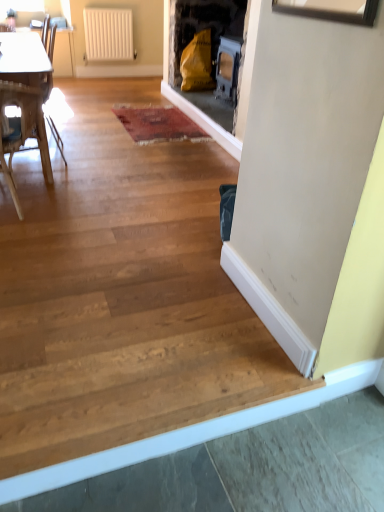
Question: From a real-world perspective, is white plastic radiator at upper center physically located above or below wooden armchair at left?

Choices:
 (A) below
 (B) above

Answer: (B)

Question: Is white plastic radiator at upper center inside the boundaries of wooden armchair at left, or outside?

Choices:
 (A) inside
 (B) outside

Answer: (B)

Question: Which of these objects is positioned farthest from the wooden armchair at left?

Choices:
 (A) wooden chair at left
 (B) white plastic radiator at upper center

Answer: (A)

Question: Which object is the farthest from the wooden armchair at left?

Choices:
 (A) wooden chair at left
 (B) white plastic radiator at upper center

Answer: (A)